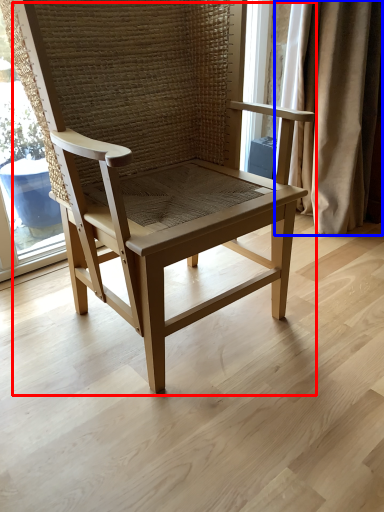
Question: Which of the following is the closest to the observer, chair (highlighted by a red box) or curtain (highlighted by a blue box)?

Choices:
 (A) chair
 (B) curtain

Answer: (A)